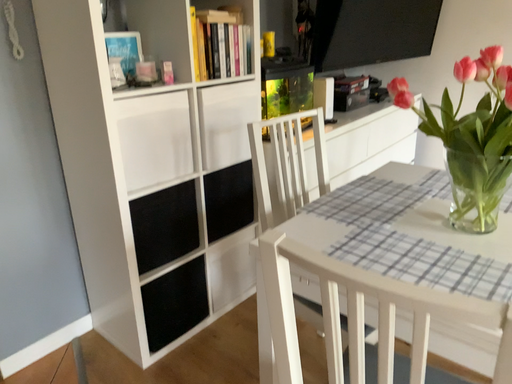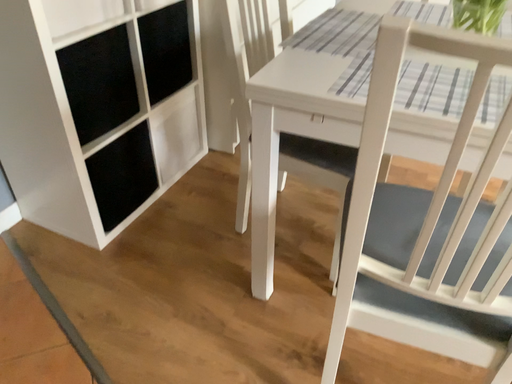
Question: Which way did the camera rotate in the video?

Choices:
 (A) rotated right
 (B) rotated left

Answer: (A)